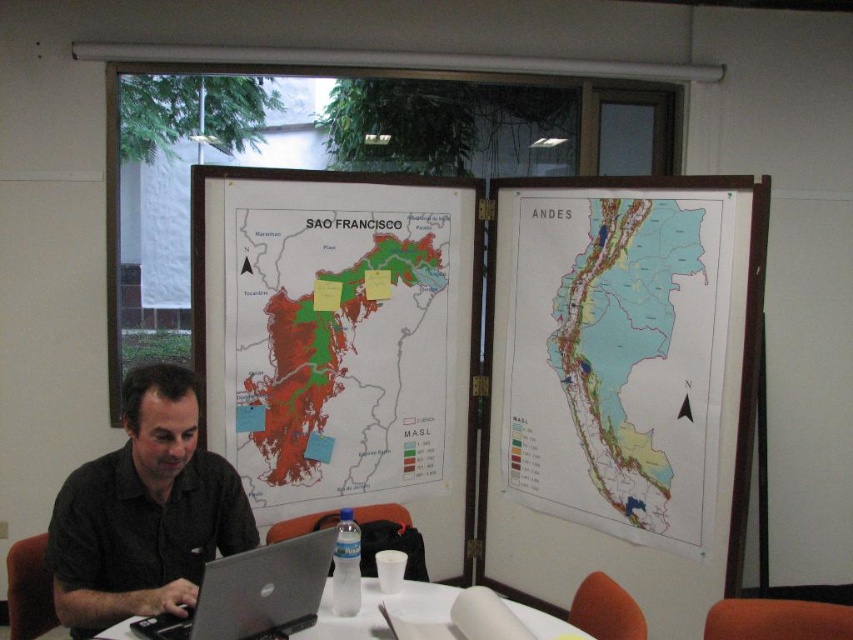
You are organizing a presentation and need to place both the green matte map at center and the white paper at center on a projector screen. The screen has a maximum width of 1.2 meters. Can both items fit side by side without overlapping?

The green matte map at center is wider than the white paper at center. Since the screen can only accommodate up to 1.2 meters, we need to know their combined width. However, the exact dimensions of each item aren

You are organizing a presentation and need to know which map is shorter in height between the green matte map at center and the light blue paper map at center right. Can you determine this?

The green matte map at center has a lesser height compared to the light blue paper map at center right, so the green matte map at center is shorter in height.